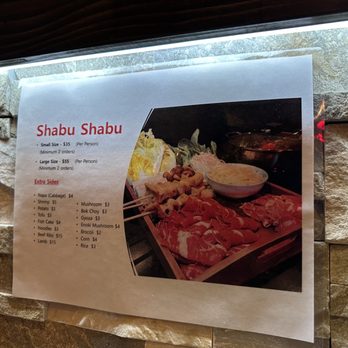
Identify the location of bowl. (238, 191).